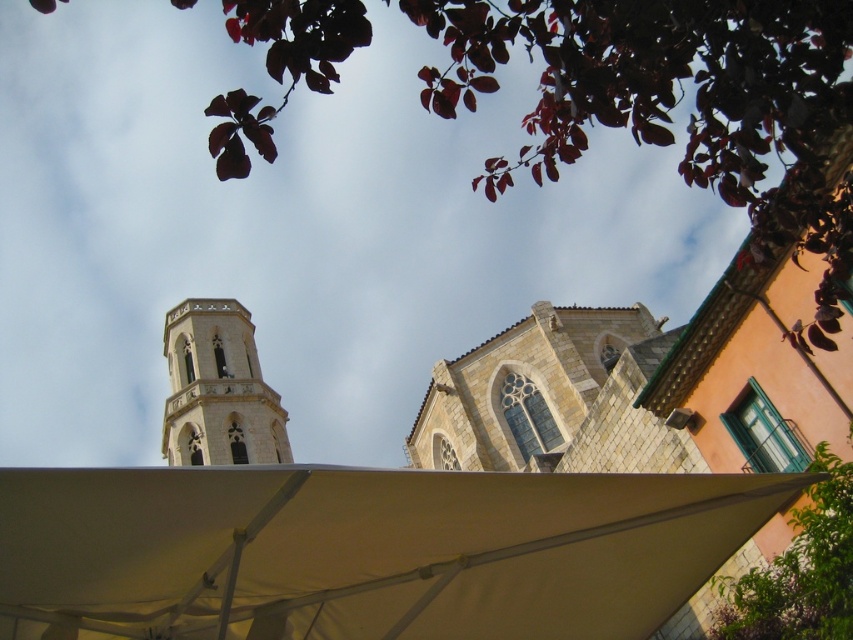
You are standing in front of the church and want to take a photo of the stone tower at center without the white fabric canopy at center blocking the view. Is it possible to do so based on their positions?

The white fabric canopy at center is closer to the viewer than the stone tower at center, so the canopy may block the view of the tower. To take a photo without the canopy blocking, you would need to move to a position where the canopy is no longer in front of the tower.

You are planning to set up a small table under the white fabric canopy at center for a church event. Considering the size of the canopy and the nearby stone tower at center, can the table fit comfortably under the canopy without being too close to the tower?

The white fabric canopy at center has a smaller size compared to the stone tower at center, so the table can fit under the canopy but may be positioned closer to the tower due to the limited space.

You are standing in front of the historic stone church and notice the white fabric canopy at center and the stone tower at center. Which object is located to the right of the other?

The white fabric canopy at center is positioned on the right side of stone tower at center.